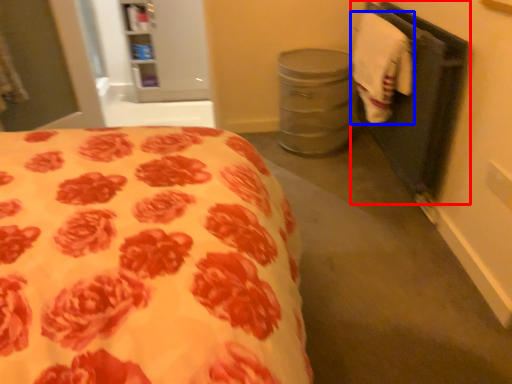
Question: Which point is closer to the camera, closet (highlighted by a red box) or hand towel (highlighted by a blue box)?

Choices:
 (A) closet
 (B) hand towel

Answer: (A)